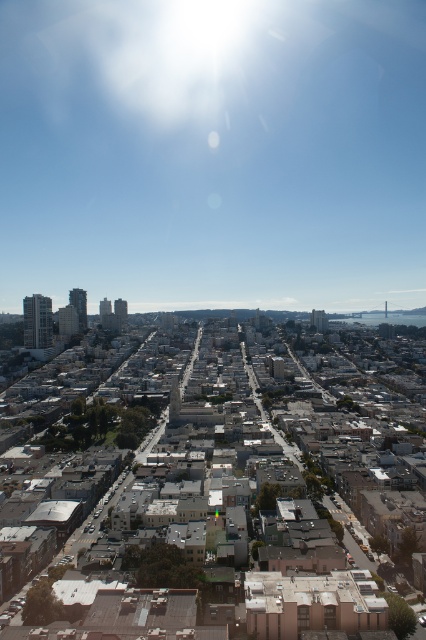
You are a drone operator tasked with capturing aerial footage of the city. You notice the bright white sunlight at upper center and the gray concrete buildings at center. Which of these two objects would appear more prominent in your camera frame due to their size?

The bright white sunlight at upper center would appear more prominent in the camera frame because it is larger in size than the gray concrete buildings at center.

You are a drone operator tasked with delivering a package to a building in the city. Your drone has a maximum flight altitude of 100 meters. Considering the bright white sunlight at upper center and the gray concrete buildings at center, can your drone safely navigate between them without exceeding its altitude limit?

The bright white sunlight at upper center is located above the gray concrete buildings at center, so the drone can safely navigate between them as long as it stays below the sunlight area, which is above the buildings. Since the altitude limit is 100 meters, the drone should ensure it doesn not ascend beyond the building heights and remains within the allowed altitude.